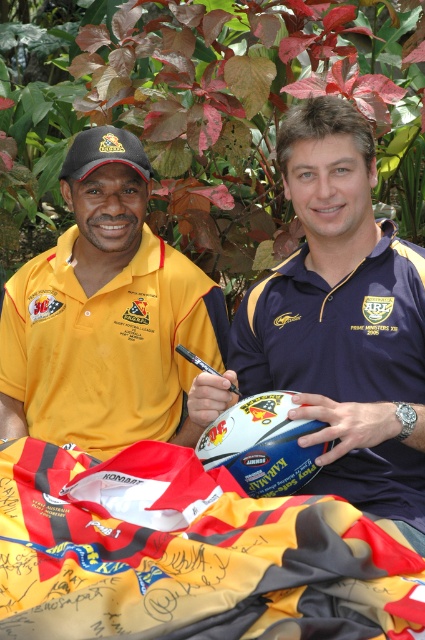
You are a photographer trying to capture a closeup of the yellow and red jersey at lower center. The camera is at position point (189, 554). Is the camera positioned correctly to get a clear shot of the jersey?

The point (189, 554) is on the yellow and red jersey at lower center, so yes, the camera is positioned correctly to capture a clear shot of the jersey.

You are a photographer taking a picture of the yellow and red jersey at lower center and the blue fabric polo shirt at center. Which one is closer to the camera?

The blue fabric polo shirt at center is closer to the camera because the yellow and red jersey at lower center is positioned under it.